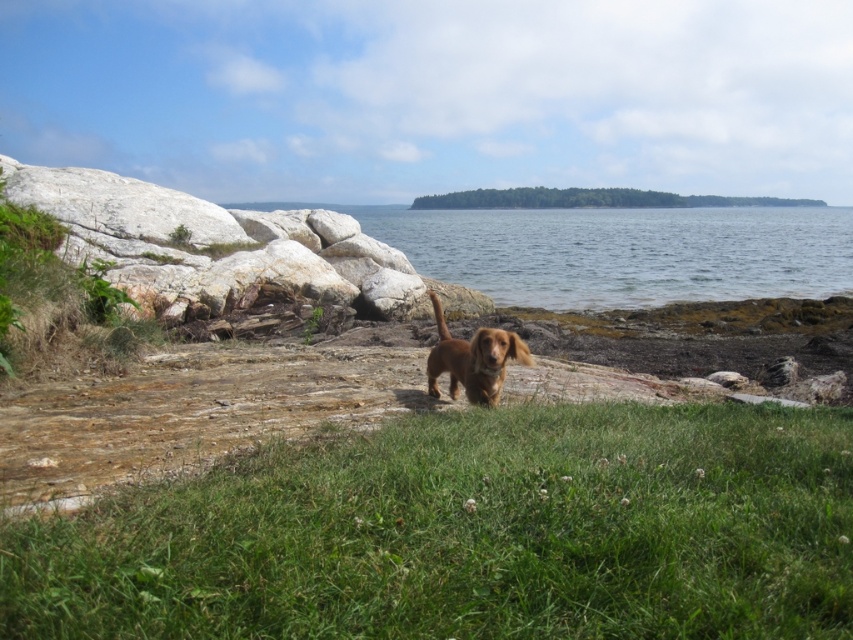
You are planning to set up a small tent in the green grassy area at center. The tent requires a space that is wider than the golden brown fur dog at center. Based on the scene, is the green grassy at center wide enough to accommodate the tent?

The green grassy at center might be wider than golden brown fur dog at center, so it could potentially accommodate the tent if the required width matches or is less than the grassy area.